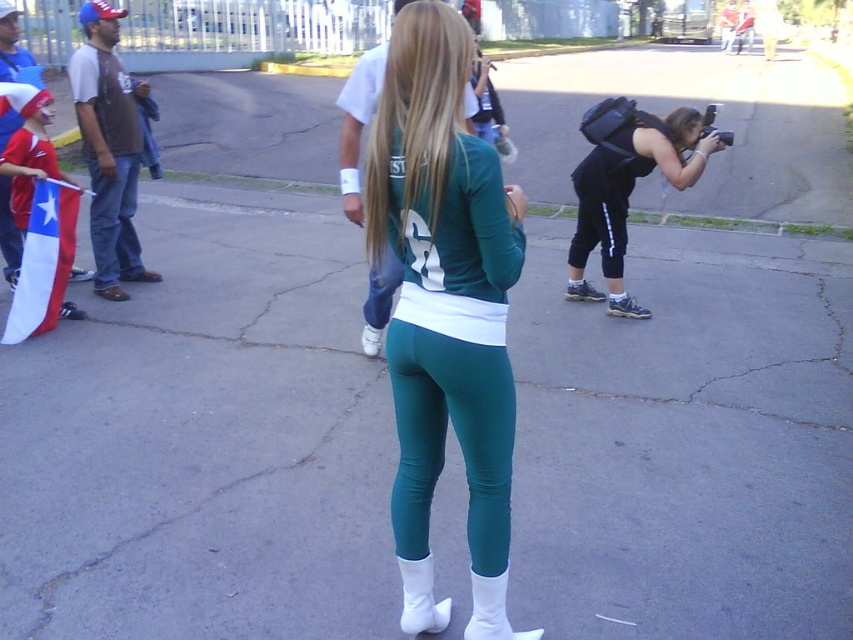
You are standing at the center of the paved area in the scene. You need to locate the brown leather jacket at left. Which direction should you turn to face it?

The brown leather jacket at left is located at point 0.233 on the x axis and 0.129 on the y axis. Since the jacket is at the left side of the scene, you should turn to your left to face it.

Based on the scene description, where is the green smooth leggings located relative to the point with coordinates [456,435]?

The green smooth leggings at center are located exactly at the point with coordinates [456,435].